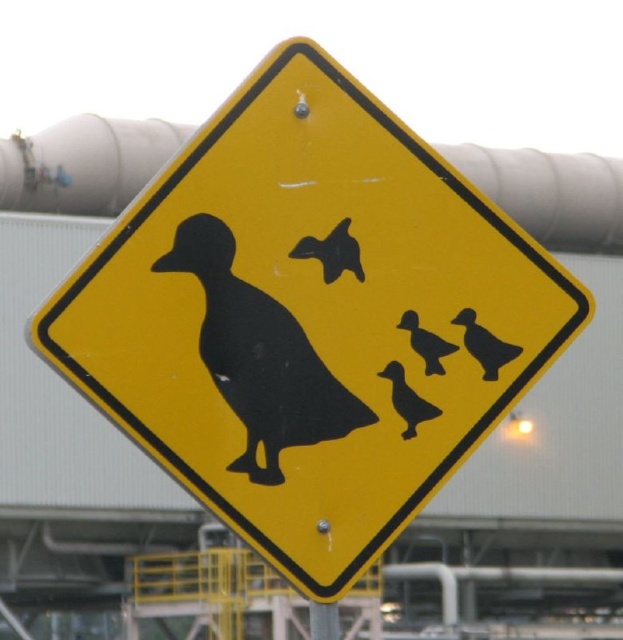
Who is positioned more to the right, matte black duckling at lower right or black matte duckling at center?

From the viewer's perspective, matte black duckling at lower right appears more on the right side.

Is point (490, 349) positioned before point (457, 346)?

No, (490, 349) is behind (457, 346).

You are a GUI agent. You are given a task and a screenshot of the screen. Output one action in this format:
    pyautogui.click(x=<x>, y=<y>)
    Task: Click on the matte black duckling at lower right
    The image size is (623, 640).
    Given the screenshot: What is the action you would take?
    pyautogui.click(x=483, y=344)

Who is positioned more to the left, matte black duckling at lower right or black matte duck at lower right?

Positioned to the left is black matte duck at lower right.

Does matte black duckling at lower right appear under black matte duck at lower right?

Actually, matte black duckling at lower right is above black matte duck at lower right.

Is point (493, 346) farther from viewer compared to point (392, 371)?

Yes, point (493, 346) is behind point (392, 371).

Where is `matte black duckling at lower right`? This screenshot has height=640, width=623. matte black duckling at lower right is located at coordinates click(x=483, y=344).

Is black matte duck at center wider than black matte duckling at center?

Correct, the width of black matte duck at center exceeds that of black matte duckling at center.

Is black matte duck at center to the right of black matte duckling at center from the viewer's perspective?

No, black matte duck at center is not to the right of black matte duckling at center.

Which is behind, point (278, 353) or point (411, 346)?

Positioned behind is point (411, 346).

Where is `black matte duck at center`? The width and height of the screenshot is (623, 640). black matte duck at center is located at coordinates (259, 356).